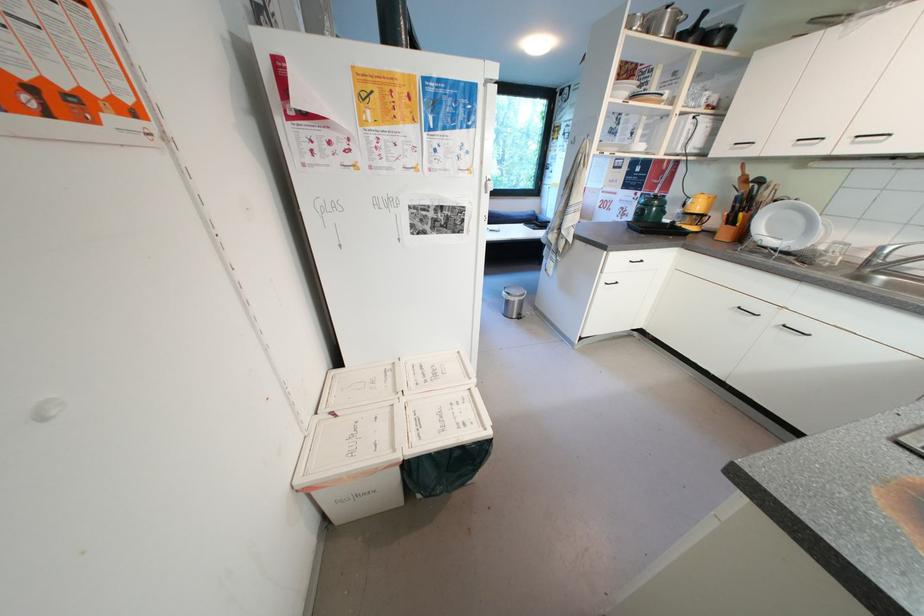
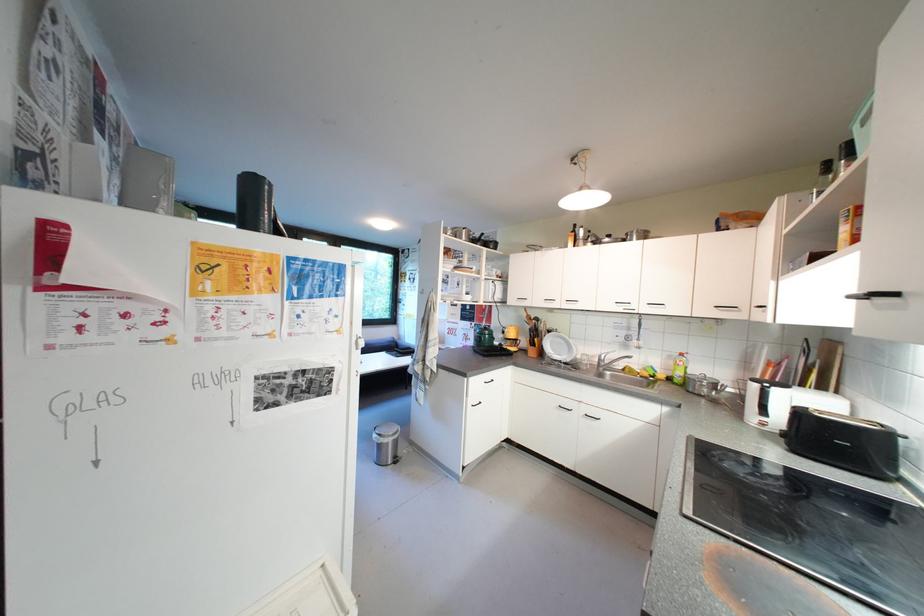
In the second image, find the point that corresponds to point 512,294 in the first image.

(383, 438)